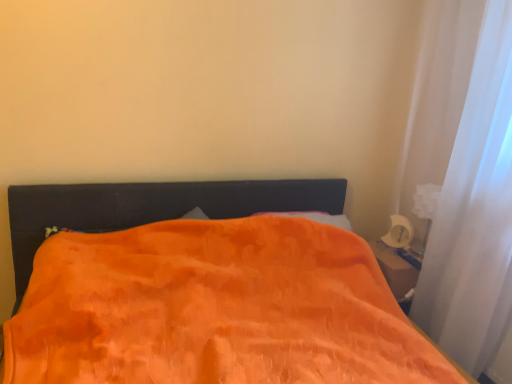
Describe the element at coordinates (464, 181) in the screenshot. This screenshot has width=512, height=384. I see `white sheer curtain at right` at that location.

Find the location of a particular element. The width and height of the screenshot is (512, 384). white sheer curtain at right is located at coordinates (464, 181).

Image resolution: width=512 pixels, height=384 pixels. What do you see at coordinates (214, 308) in the screenshot?
I see `orange soft blanket at center` at bounding box center [214, 308].

The height and width of the screenshot is (384, 512). In order to click on orange soft blanket at center in this screenshot , I will do `click(214, 308)`.

Image resolution: width=512 pixels, height=384 pixels. Find the location of `white sheer curtain at right`. white sheer curtain at right is located at coordinates (464, 181).

Would you say orange soft blanket at center is to the left or to the right of white sheer curtain at right in the picture?

orange soft blanket at center is positioned on white sheer curtain at right's left side.

Is the position of orange soft blanket at center more distant than that of white sheer curtain at right?

No, orange soft blanket at center is closer to the camera.

Is point (318, 269) closer or farther from the camera than point (439, 159)?

Point (318, 269) appears to be closer to the viewer than point (439, 159).

From the image's perspective, which object appears higher, orange soft blanket at center or white sheer curtain at right?

white sheer curtain at right appears higher in the image.

From a real-world perspective, is orange soft blanket at center above or below white sheer curtain at right?

Clearly, from a real-world perspective, orange soft blanket at center is below white sheer curtain at right.

Considering the sizes of objects orange soft blanket at center and white sheer curtain at right in the image provided, who is thinner, orange soft blanket at center or white sheer curtain at right?

white sheer curtain at right.

Between orange soft blanket at center and white sheer curtain at right, which one has less height?

With less height is orange soft blanket at center.

Considering the relative sizes of orange soft blanket at center and white sheer curtain at right in the image provided, is orange soft blanket at center bigger than white sheer curtain at right?

Indeed, orange soft blanket at center has a larger size compared to white sheer curtain at right.

Is orange soft blanket at center not inside white sheer curtain at right?

Yes, orange soft blanket at center is located beyond the bounds of white sheer curtain at right.

Is orange soft blanket at center not near white sheer curtain at right?

orange soft blanket at center is near white sheer curtain at right, not far away.

Is orange soft blanket at center oriented towards white sheer curtain at right?

No.

How many degrees apart are the facing directions of orange soft blanket at center and white sheer curtain at right?

orange soft blanket at center and white sheer curtain at right are facing 90 degrees away from each other.

Measure the distance between orange soft blanket at center and white sheer curtain at right.

orange soft blanket at center is 87.20 centimeters away from white sheer curtain at right.

Identify the location of bed on the left of white sheer curtain at right. coord(214,308).

Consider the image. Considering the positions of objects white sheer curtain at right and orange soft blanket at center in the image provided, who is more to the left, white sheer curtain at right or orange soft blanket at center?

orange soft blanket at center is more to the left.

Which is in front, white sheer curtain at right or orange soft blanket at center?

Positioned in front is orange soft blanket at center.

Does point (487, 228) come farther from viewer compared to point (202, 297)?

Yes, it is.

From the image's perspective, between white sheer curtain at right and orange soft blanket at center, which one is located above?

A: white sheer curtain at right, from the image's perspective.

From a real-world perspective, relative to orange soft blanket at center, is white sheer curtain at right vertically above or below?

In terms of real-world spatial position, white sheer curtain at right is above orange soft blanket at center.

Does white sheer curtain at right have a lesser width compared to orange soft blanket at center?

Yes.

Considering the sizes of white sheer curtain at right and orange soft blanket at center in the image, is white sheer curtain at right taller or shorter than orange soft blanket at center?

In the image, white sheer curtain at right appears to be taller than orange soft blanket at center.

Between white sheer curtain at right and orange soft blanket at center, which one has larger size?

With larger size is orange soft blanket at center.

Would you say white sheer curtain at right is outside orange soft blanket at center?

Yes, white sheer curtain at right is not within orange soft blanket at center.

Are white sheer curtain at right and orange soft blanket at center beside each other?

No, white sheer curtain at right is not with orange soft blanket at center.

Is white sheer curtain at right facing away from orange soft blanket at center?

No, white sheer curtain at right is not facing away from orange soft blanket at center.

From the picture: What's the angular difference between white sheer curtain at right and orange soft blanket at center's facing directions?

The angle between the facing direction of white sheer curtain at right and the facing direction of orange soft blanket at center is 90 degrees.

Find the location of a particular element. bed that appears on the left of white sheer curtain at right is located at coordinates (214, 308).

Where is `curtain above the orange soft blanket at center (from the image's perspective)`? The width and height of the screenshot is (512, 384). curtain above the orange soft blanket at center (from the image's perspective) is located at coordinates (464, 181).

Find the location of `bed below the white sheer curtain at right (from the image's perspective)`. bed below the white sheer curtain at right (from the image's perspective) is located at coordinates (214, 308).